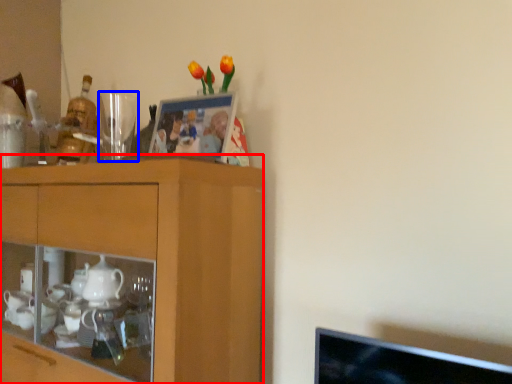
Question: Which object appears farthest to the camera in this image, cabinetry (highlighted by a red box) or tableware (highlighted by a blue box)?

Choices:
 (A) cabinetry
 (B) tableware

Answer: (B)